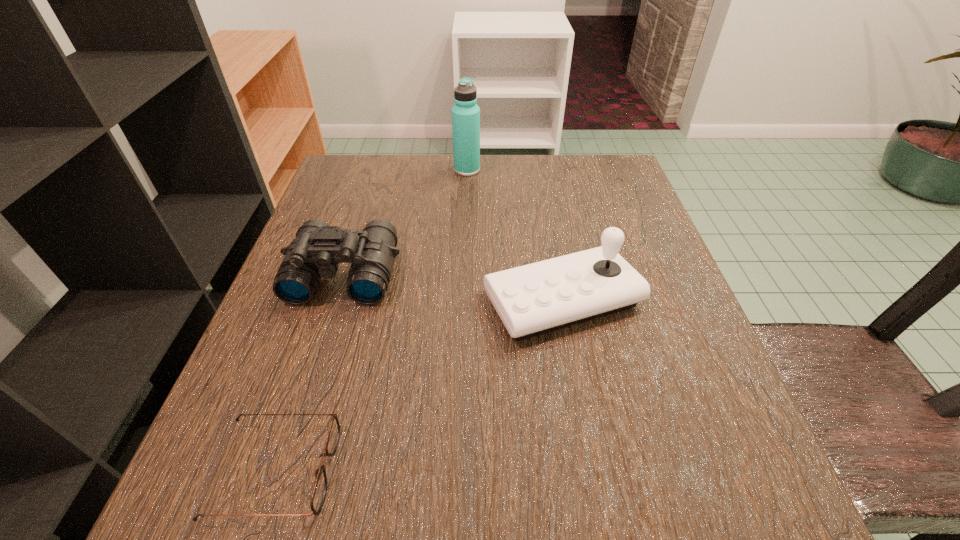
At what (x,y) coordinates should I click in order to perform the action: click on free spot that satisfies the following two spatial constraints: 1. on the front side of the rightmost object; 2. on the right side of the second object from right to left. Please return your answer as a coordinate pair (x, y). The width and height of the screenshot is (960, 540). Looking at the image, I should click on (462, 300).